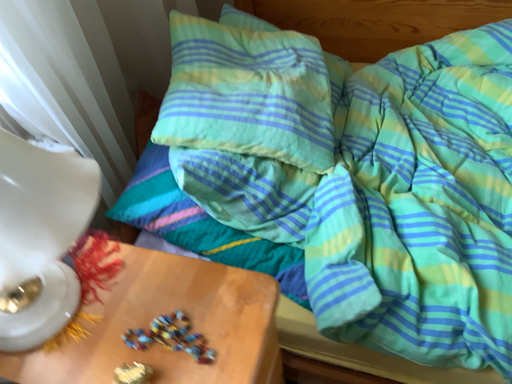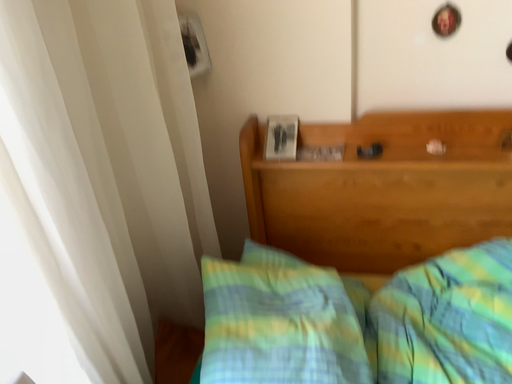
Question: How did the camera likely rotate when shooting the video?

Choices:
 (A) rotated downward
 (B) rotated upward

Answer: (B)